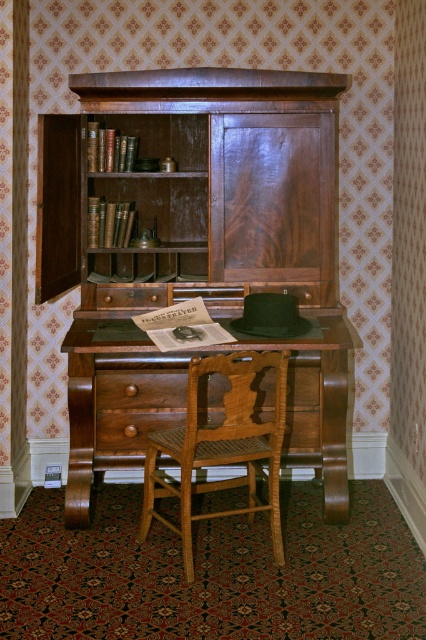
Question: Which point is closer to the camera?

Choices:
 (A) (293, 224)
 (B) (195, 445)
 (C) (71, 412)

Answer: (B)

Question: Does wooden desk at center have a lesser width compared to light brown wooden chair at center?

Choices:
 (A) no
 (B) yes

Answer: (A)

Question: Which of these objects is positioned farthest from the wooden desk at center?

Choices:
 (A) mahogany wood bookcase at center
 (B) light brown wooden chair at center

Answer: (A)

Question: Can you confirm if mahogany wood bookcase at center is wider than wooden desk at center?

Choices:
 (A) yes
 (B) no

Answer: (A)

Question: In this image, where is wooden desk at center located relative to light brown wooden chair at center?

Choices:
 (A) right
 (B) left

Answer: (B)

Question: Which point is closer to the camera taking this photo?

Choices:
 (A) (81, 480)
 (B) (120, 262)

Answer: (A)